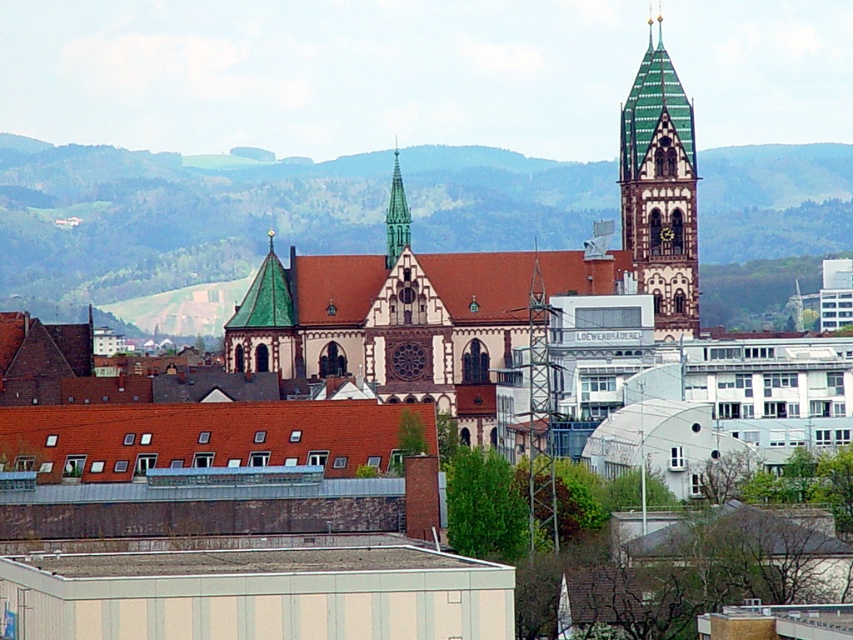
Between green mosaic tower at upper center and dark brown wooden clock at center, which one has less height?

dark brown wooden clock at center is shorter.

Which is more to the left, green mosaic tower at upper center or dark brown wooden clock at center?

Positioned to the left is green mosaic tower at upper center.

Describe the element at coordinates (660, 189) in the screenshot. I see `green mosaic tower at upper center` at that location.

You are a GUI agent. You are given a task and a screenshot of the screen. Output one action in this format:
    pyautogui.click(x=<x>, y=<y>)
    Task: Click on the green mosaic tower at upper center
    The height and width of the screenshot is (640, 853).
    Given the screenshot: What is the action you would take?
    pyautogui.click(x=660, y=189)

Between green mosaic tower at upper center and green glass spire at center, which one is positioned lower?

green mosaic tower at upper center

Between point (672, 291) and point (402, 250), which one is positioned in front?

Point (402, 250) is in front.

Find the location of `green mosaic tower at upper center`. green mosaic tower at upper center is located at coordinates tap(660, 189).

Between green glass spire at center and dark brown wooden clock at center, which one is positioned lower?

dark brown wooden clock at center

Is green glass spire at center wider than dark brown wooden clock at center?

Correct, the width of green glass spire at center exceeds that of dark brown wooden clock at center.

Does point (393, 166) come closer to viewer compared to point (662, 234)?

No.

Identify the location of green glass spire at center. This screenshot has height=640, width=853. (396, 216).